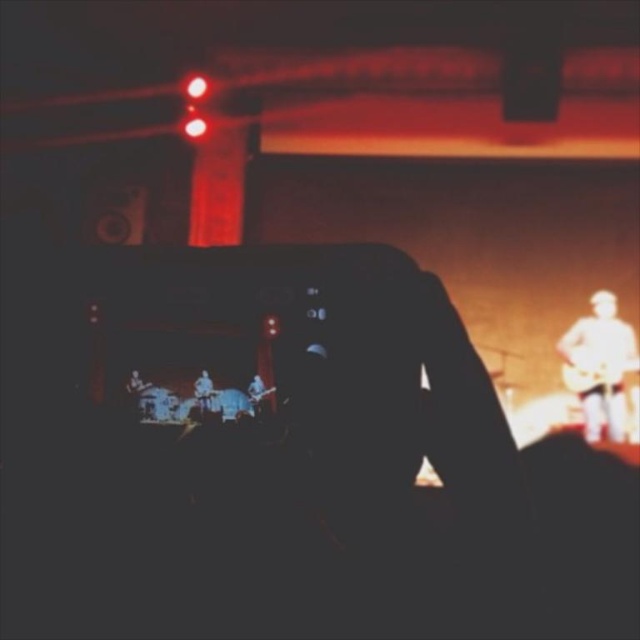
Question: Which of the following is the closest to the observer?

Choices:
 (A) light brown wooden guitar at right
 (B) wooden acoustic guitar at right
 (C) light blue fabric at center

Answer: (C)

Question: Can you confirm if wooden acoustic guitar at right is thinner than light blue fabric at center?

Choices:
 (A) no
 (B) yes

Answer: (A)

Question: Based on their relative distances, which object is nearer to the shiny silver guitar at center?

Choices:
 (A) wooden acoustic guitar at right
 (B) light blue fabric at center
 (C) light brown wooden guitar at right

Answer: (B)

Question: Can you confirm if light brown wooden guitar at right is thinner than light blue fabric at center?

Choices:
 (A) no
 (B) yes

Answer: (A)

Question: Is light brown wooden guitar at right thinner than wooden acoustic guitar at right?

Choices:
 (A) no
 (B) yes

Answer: (A)

Question: Among these objects, which one is nearest to the camera?

Choices:
 (A) shiny silver guitar at center
 (B) light brown wooden guitar at right
 (C) wooden acoustic guitar at right
 (D) light blue fabric at center

Answer: (A)